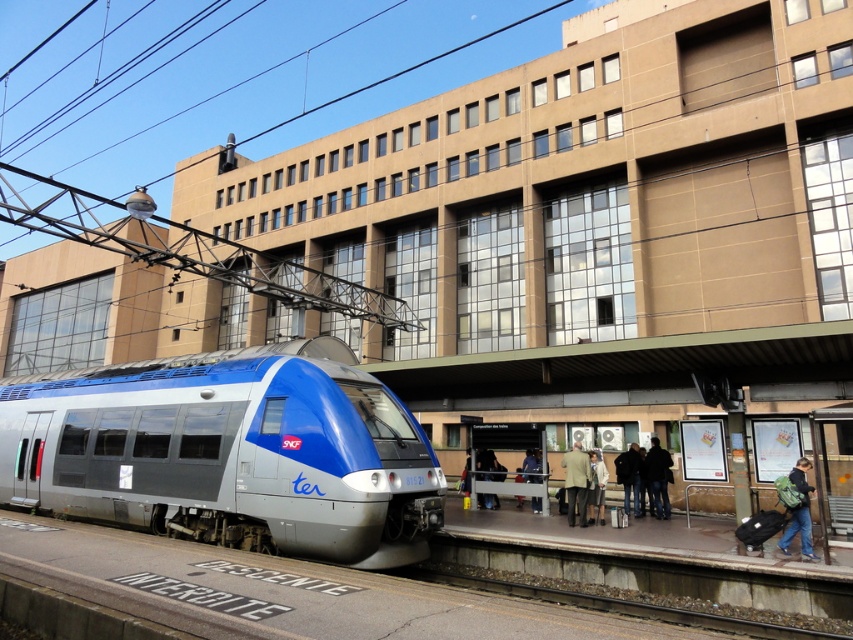
You are a traveler at the train station and you see the green backpack at lower right and the metallic silver coach at center. Which object is smaller in size?

The green backpack at lower right is smaller than the metallic silver coach at center.

You are a passenger at the train station and need to place your green backpack at lower right onto the metallic silver coach at center. Is the backpack positioned in a way that allows you to easily access it when the train departs?

The green backpack at lower right is located above the metallic silver coach at center, so it is likely positioned in a place where you can easily reach it when the train departs.